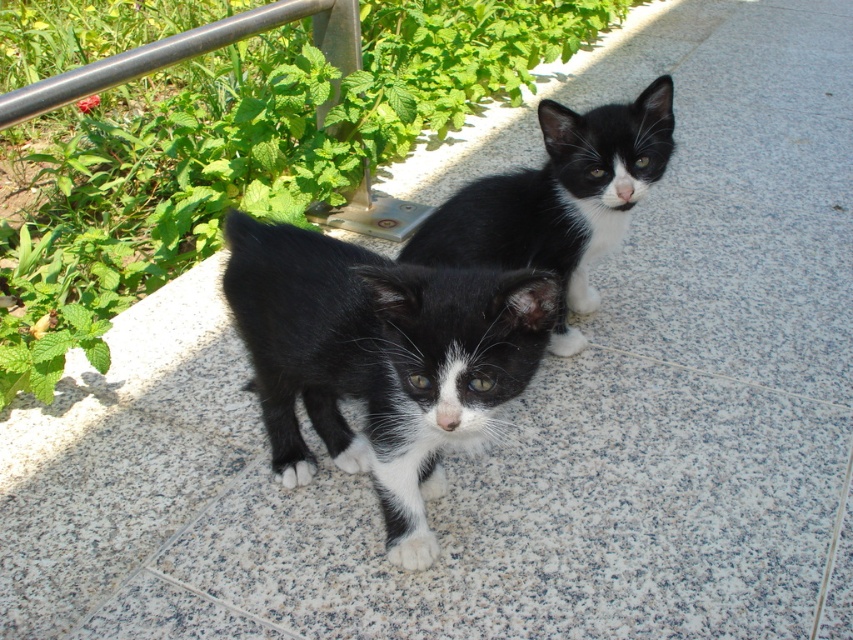
At what (x,y) coordinates should I click in order to perform the action: click on black fur kitten at center. Please return your answer as a coordinate pair (x, y). The height and width of the screenshot is (640, 853). Looking at the image, I should click on (378, 356).

Is black fur kitten at center taller than black matte fur cat at upper center?

Yes.

Find the location of a particular element. This screenshot has height=640, width=853. black fur kitten at center is located at coordinates (378, 356).